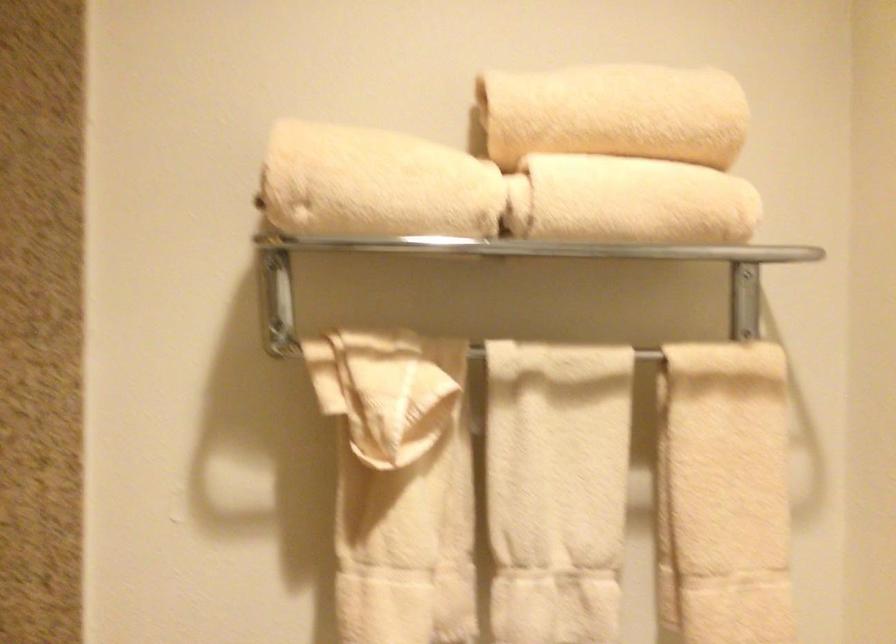
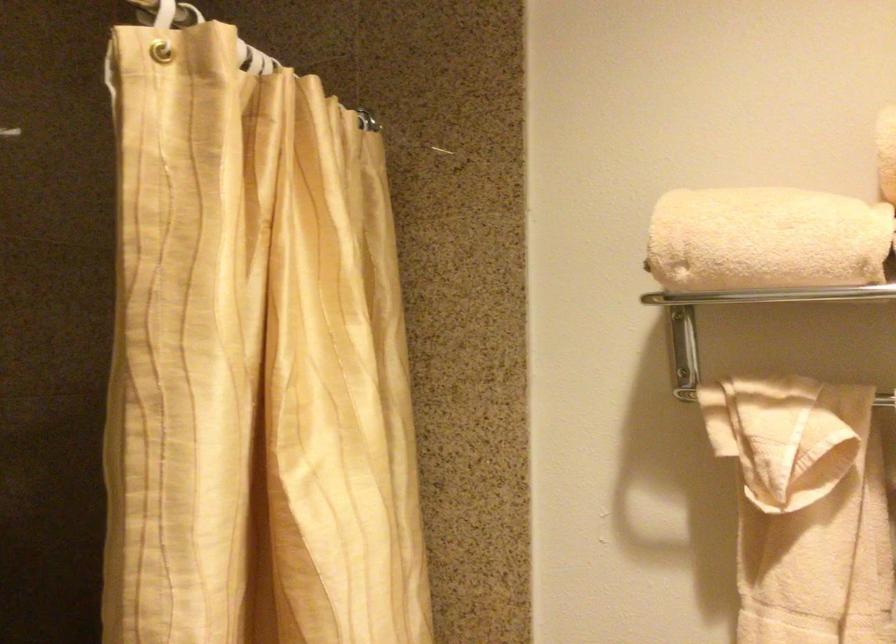
Question: The images are taken continuously from a first-person perspective. In which direction is your viewpoint rotating?

Choices:
 (A) Left
 (B) Right
 (C) Up
 (D) Down

Answer: (A)